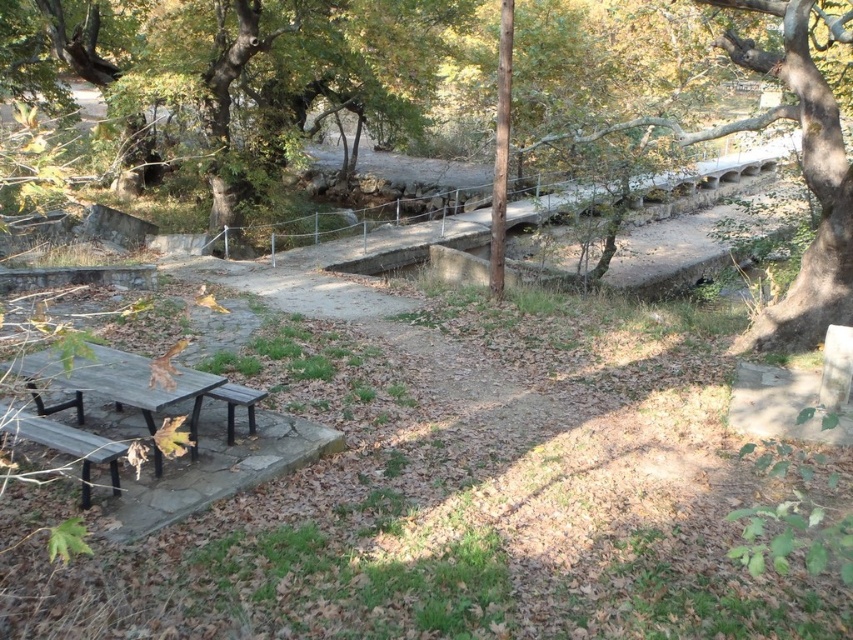
You are planning to take a photo of the green leafy tree at upper left and the smooth bark tree at upper right. Which tree should you focus on if you want to capture the wider tree in your shot?

The green leafy tree at upper left is wider than the smooth bark tree at upper right, so you should focus on the green leafy tree at upper left to capture the wider tree in your shot.